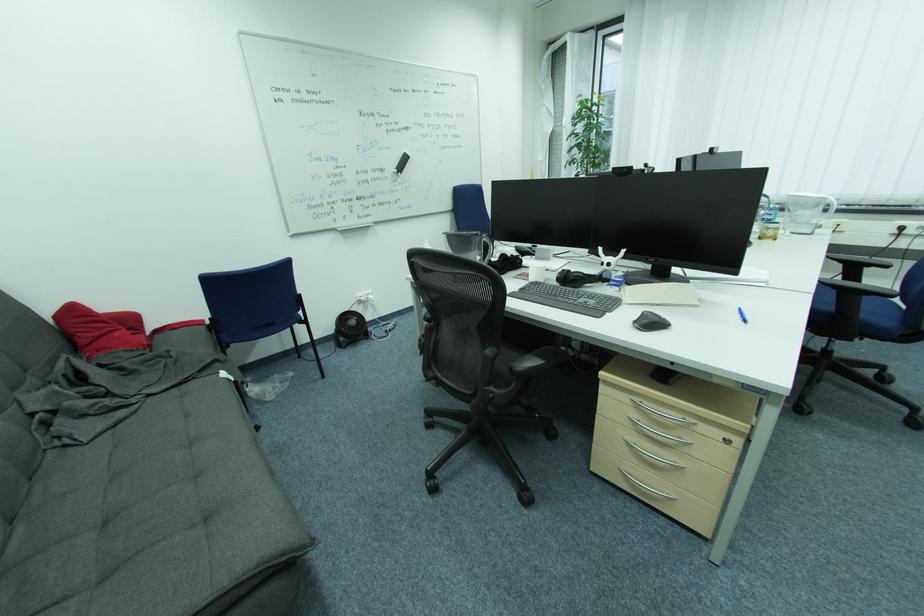
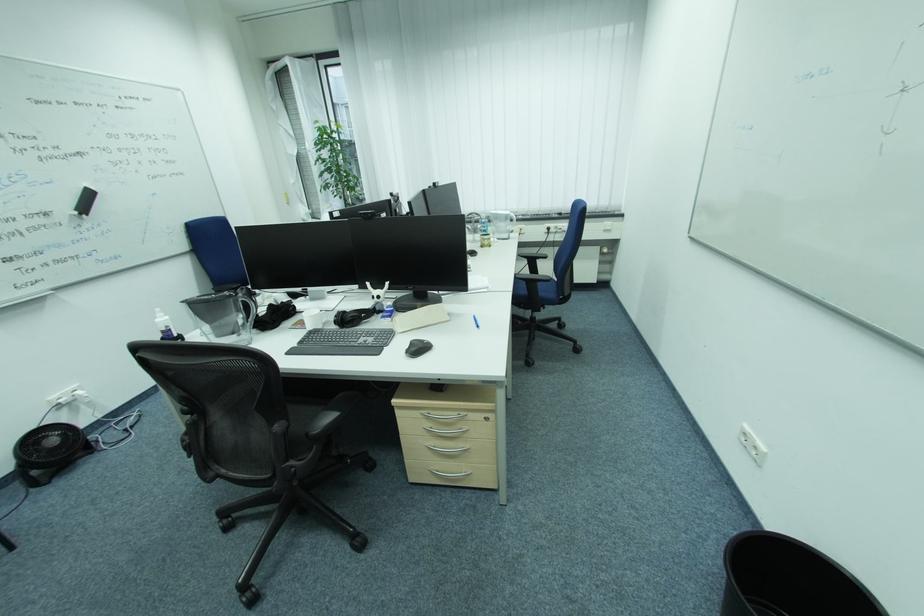
Where in the second image is the point corresponding to [651,322] from the first image?

(419, 350)